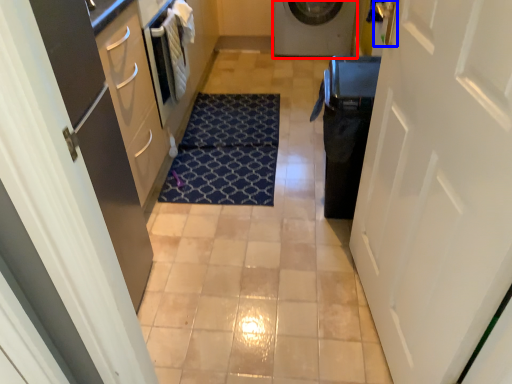
Question: Which of the following is the farthest to the observer, washing machine (highlighted by a red box) or door handle (highlighted by a blue box)?

Choices:
 (A) washing machine
 (B) door handle

Answer: (A)